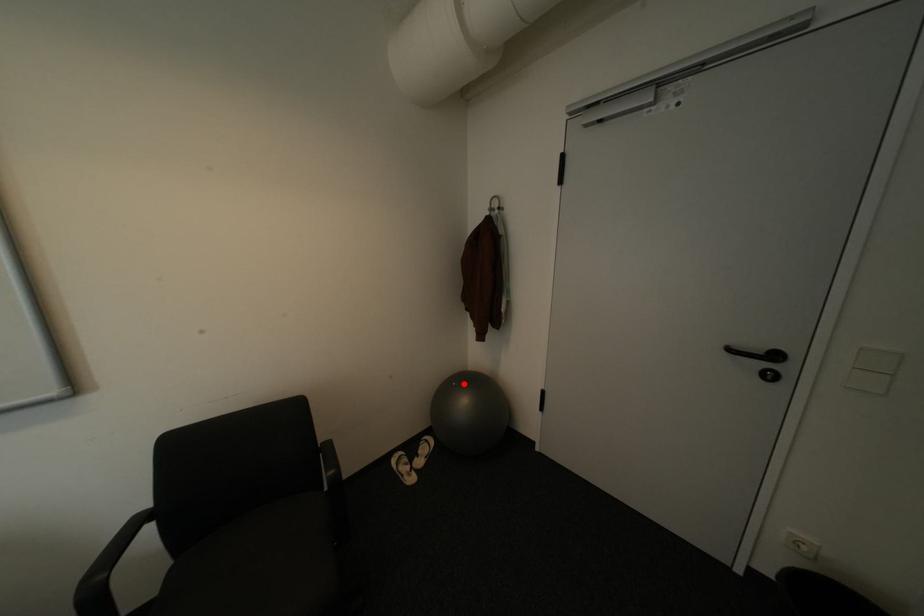
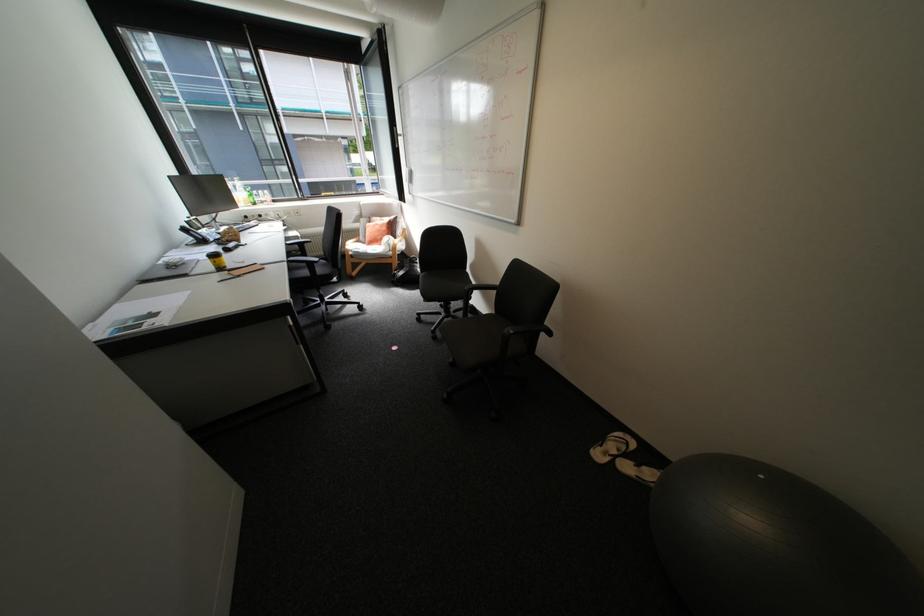
Where in the second image is the point corresponding to the highlighted location from the first image?

(772, 477)